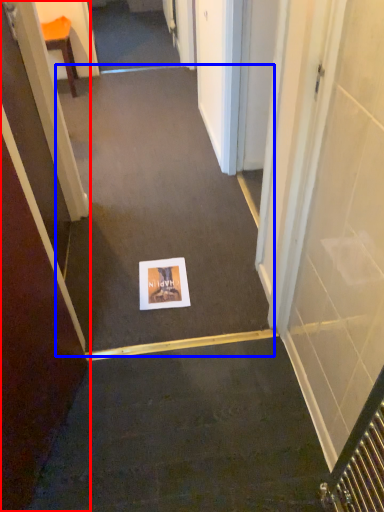
Question: Which of the following is the closest to the observer, door (highlighted by a red box) or path (highlighted by a blue box)?

Choices:
 (A) door
 (B) path

Answer: (A)